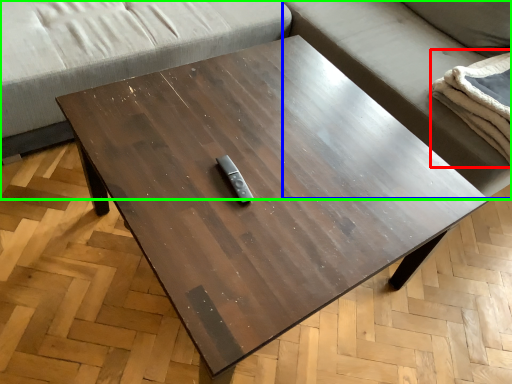
Question: Which object is positioned closest to blanket (highlighted by a red box)? Select from couch (highlighted by a blue box) and studio couch (highlighted by a green box).

Choices:
 (A) couch
 (B) studio couch

Answer: (A)